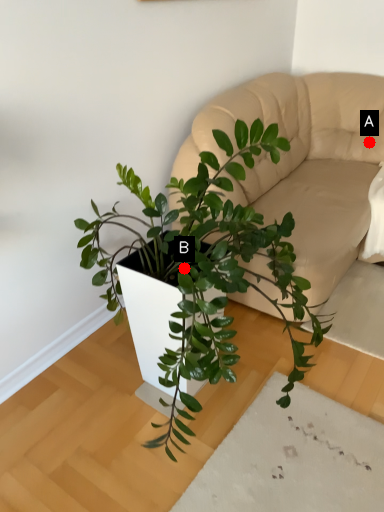
Question: Two points are circled on the image, labeled by A and B beside each circle. Which point is closer to the camera taking this photo?

Choices:
 (A) A is closer
 (B) B is closer

Answer: (B)